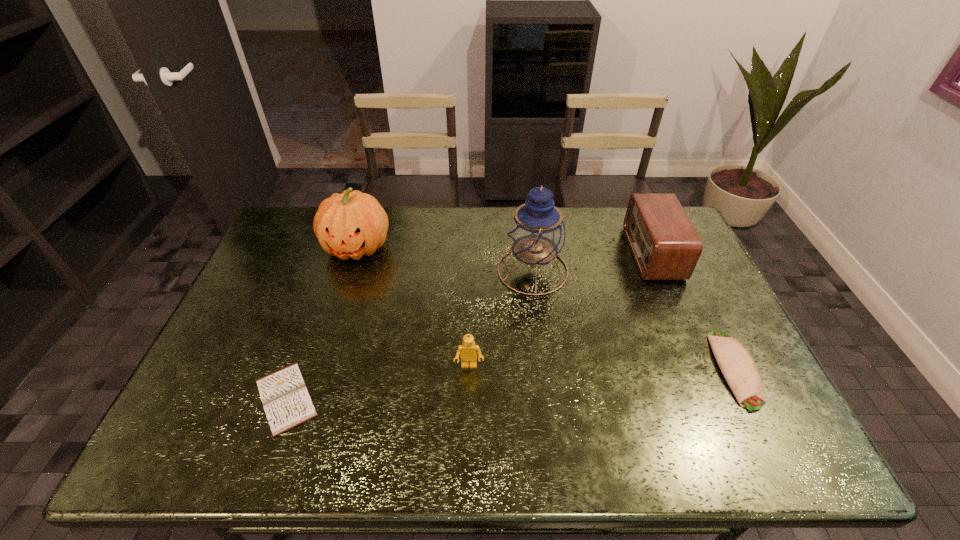
At what (x,y) coordinates should I click in order to perform the action: click on radio receiver that is at the far edge. Please return your answer as a coordinate pair (x, y). The image size is (960, 540). Looking at the image, I should click on (665, 245).

Identify the location of object that is positioned at the near edge. (287, 403).

This screenshot has width=960, height=540. I want to click on object that is at the left edge, so click(287, 403).

Find the location of a particular element. This screenshot has width=960, height=540. radio receiver that is at the right edge is located at coordinates (665, 245).

The height and width of the screenshot is (540, 960). I want to click on burrito that is at the right edge, so click(x=739, y=369).

This screenshot has width=960, height=540. I want to click on object positioned at the near left corner, so click(x=287, y=403).

You are a GUI agent. You are given a task and a screenshot of the screen. Output one action in this format:
    pyautogui.click(x=<x>, y=<y>)
    Task: Click on the object located at the far right corner
    
    Given the screenshot: What is the action you would take?
    pyautogui.click(x=665, y=245)

Identify the location of vacant region at the far edge of the desktop. The height and width of the screenshot is (540, 960). (609, 244).

Locate an element on the screen. Image resolution: width=960 pixels, height=540 pixels. vacant space at the near edge of the desktop is located at coordinates (291, 454).

Locate an element on the screen. free space at the left edge of the desktop is located at coordinates (285, 303).